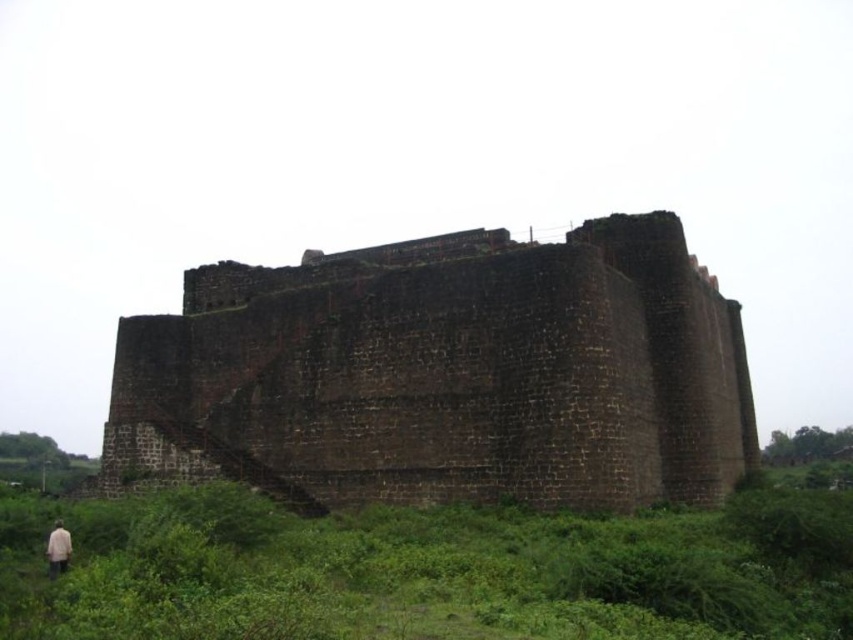
You are standing at the point marked by point (x=427, y=570), which is green leafy vegetation at lower left. You want to walk towards the ancient stone structure. Which direction should you head?

Since you are at the green leafy vegetation at lower left, which is located at point (x=427, y=570), you should head towards the upper right direction to reach the ancient stone structure because the structure is positioned opposite to the lower left area in the image.